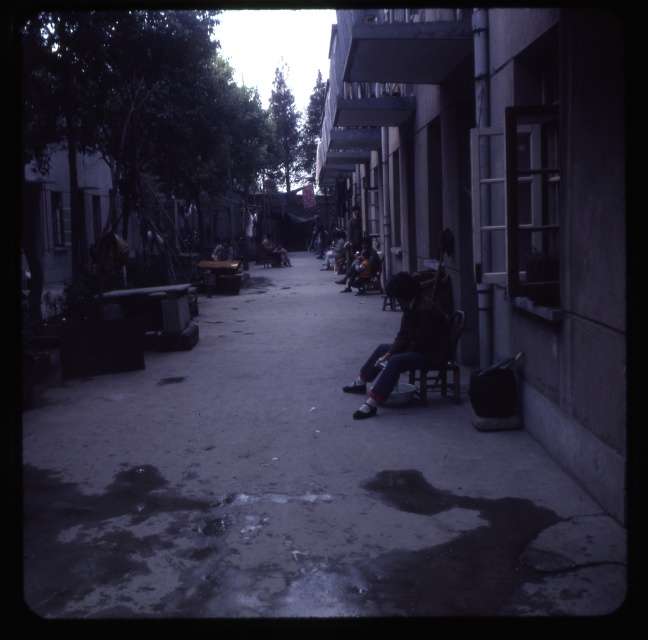
Can you confirm if smooth concrete pavement at center is shorter than dark brown leather jacket at center?

Indeed, smooth concrete pavement at center has a lesser height compared to dark brown leather jacket at center.

Can you confirm if smooth concrete pavement at center is positioned above dark brown leather jacket at center?

No, smooth concrete pavement at center is not above dark brown leather jacket at center.

Which is behind, point (567, 544) or point (439, 356)?

The point (439, 356) is behind.

Locate an element on the screen. The image size is (648, 640). smooth concrete pavement at center is located at coordinates (294, 483).